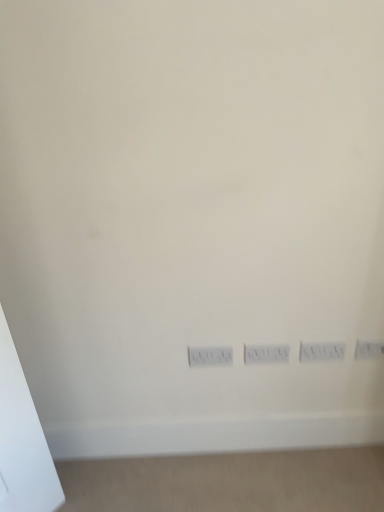
Question: Can you confirm if white plastic electric outlet at lower right, marked as the 2th electric outlet in a left-to-right arrangement, is thinner than white plastic power plugs and sockets at center?

Choices:
 (A) no
 (B) yes

Answer: (A)

Question: From a real-world perspective, is white plastic electric outlet at lower right, marked as the 2th electric outlet in a left-to-right arrangement, physically above white plastic power plugs and sockets at center?

Choices:
 (A) yes
 (B) no

Answer: (A)

Question: From the image's perspective, is white plastic electric outlet at lower right, positioned as the first electric outlet in right-to-left order, beneath white plastic power plugs and sockets at center?

Choices:
 (A) no
 (B) yes

Answer: (A)

Question: Does white plastic electric outlet at lower right, positioned as the first electric outlet in right-to-left order, come behind white plastic power plugs and sockets at center?

Choices:
 (A) no
 (B) yes

Answer: (A)

Question: From the image's perspective, is white plastic electric outlet at center, the first electric outlet viewed from the left, positioned above or below white plastic power plugs and sockets at center?

Choices:
 (A) above
 (B) below

Answer: (A)

Question: Does point (342, 352) appear closer or farther from the camera than point (210, 349)?

Choices:
 (A) closer
 (B) farther

Answer: (B)

Question: Considering their positions, is white plastic electric outlet at center, the 2th electric outlet from the right, located in front of or behind white plastic power plugs and sockets at center?

Choices:
 (A) behind
 (B) front

Answer: (B)

Question: Which is correct: white plastic electric outlet at center, the 2th electric outlet from the right, is inside white plastic power plugs and sockets at center, or outside of it?

Choices:
 (A) inside
 (B) outside

Answer: (B)

Question: In terms of height, does white plastic switch at center look taller or shorter compared to white plastic power plugs and sockets at center?

Choices:
 (A) short
 (B) tall

Answer: (B)

Question: Considering the positions of point (279, 355) and point (190, 349), is point (279, 355) closer or farther from the camera than point (190, 349)?

Choices:
 (A) farther
 (B) closer

Answer: (A)

Question: Looking at their shapes, would you say white plastic switch at center is wider or thinner than white plastic power plugs and sockets at center?

Choices:
 (A) thin
 (B) wide

Answer: (B)

Question: In terms of size, does white plastic switch at center appear bigger or smaller than white plastic power plugs and sockets at center?

Choices:
 (A) big
 (B) small

Answer: (A)

Question: In terms of size, does white plastic switch at center appear bigger or smaller than white plastic electric outlet at center, the 2th electric outlet from the right?

Choices:
 (A) small
 (B) big

Answer: (A)

Question: Is point (249, 357) closer or farther from the camera than point (307, 344)?

Choices:
 (A) closer
 (B) farther

Answer: (B)